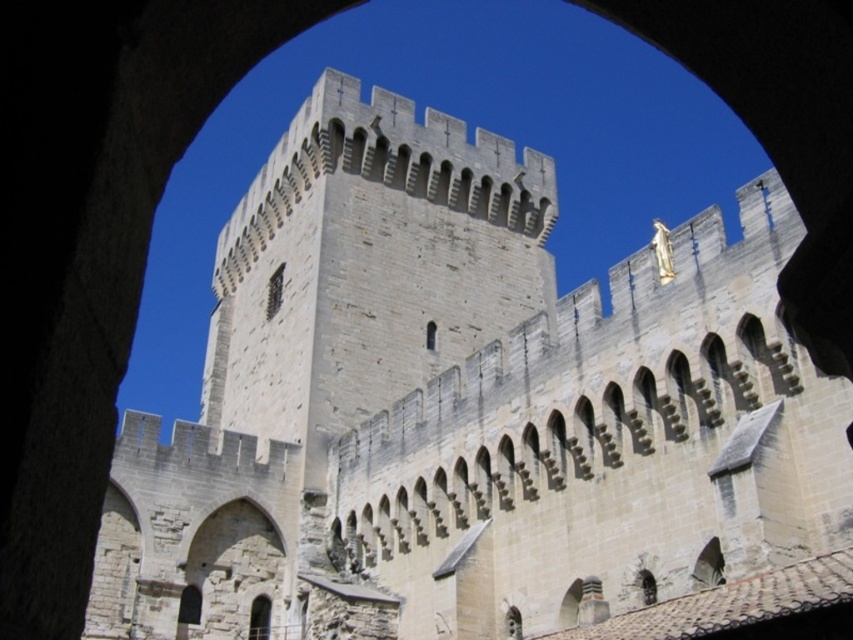
You are an architect examining the castle structure. You notice two windows in the tower, the matte stone window at center and the smooth stone window at center. Which one has a larger size?

The matte stone window at center is bigger than the smooth stone window at center, so the matte stone window at center has a larger size.